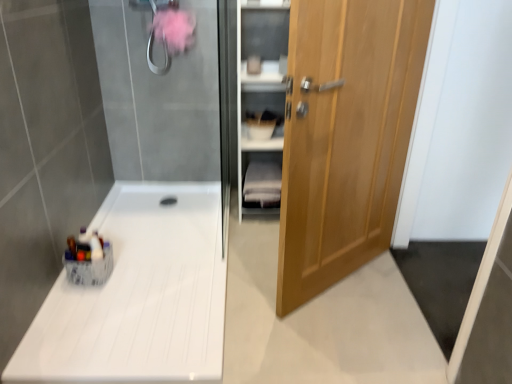
Question: From a real-world perspective, is white fabric shelf at center on light brown wooden door at right?

Choices:
 (A) yes
 (B) no

Answer: (B)

Question: Does white fabric shelf at center have a greater height compared to light brown wooden door at right?

Choices:
 (A) no
 (B) yes

Answer: (A)

Question: Is white fabric shelf at center oriented towards light brown wooden door at right?

Choices:
 (A) yes
 (B) no

Answer: (A)

Question: Is white fabric shelf at center looking in the opposite direction of light brown wooden door at right?

Choices:
 (A) yes
 (B) no

Answer: (B)

Question: Is white fabric shelf at center bigger than light brown wooden door at right?

Choices:
 (A) yes
 (B) no

Answer: (B)

Question: Is point (271, 208) positioned closer to the camera than point (109, 332)?

Choices:
 (A) farther
 (B) closer

Answer: (A)

Question: Based on their sizes in the image, would you say white fabric shelf at center is bigger or smaller than white glossy counter top at lower left?

Choices:
 (A) big
 (B) small

Answer: (B)

Question: In the image, is white fabric shelf at center positioned in front of or behind white glossy counter top at lower left?

Choices:
 (A) behind
 (B) front

Answer: (A)

Question: From a real-world perspective, relative to white glossy counter top at lower left, is white fabric shelf at center vertically above or below?

Choices:
 (A) below
 (B) above

Answer: (B)

Question: From a real-world perspective, relative to light brown wooden door at right, is white glossy counter top at lower left vertically above or below?

Choices:
 (A) below
 (B) above

Answer: (A)

Question: Looking at their shapes, would you say white glossy counter top at lower left is wider or thinner than light brown wooden door at right?

Choices:
 (A) thin
 (B) wide

Answer: (B)

Question: Looking at the image, does white glossy counter top at lower left seem bigger or smaller compared to light brown wooden door at right?

Choices:
 (A) big
 (B) small

Answer: (B)

Question: Based on their positions, is white glossy counter top at lower left located to the left or right of light brown wooden door at right?

Choices:
 (A) left
 (B) right

Answer: (A)

Question: Considering the relative positions of light brown wooden door at right and wooden cabinet at right in the image provided, is light brown wooden door at right to the left or to the right of wooden cabinet at right?

Choices:
 (A) right
 (B) left

Answer: (A)

Question: Considering the positions of light brown wooden door at right and wooden cabinet at right in the image, is light brown wooden door at right wider or thinner than wooden cabinet at right?

Choices:
 (A) thin
 (B) wide

Answer: (A)